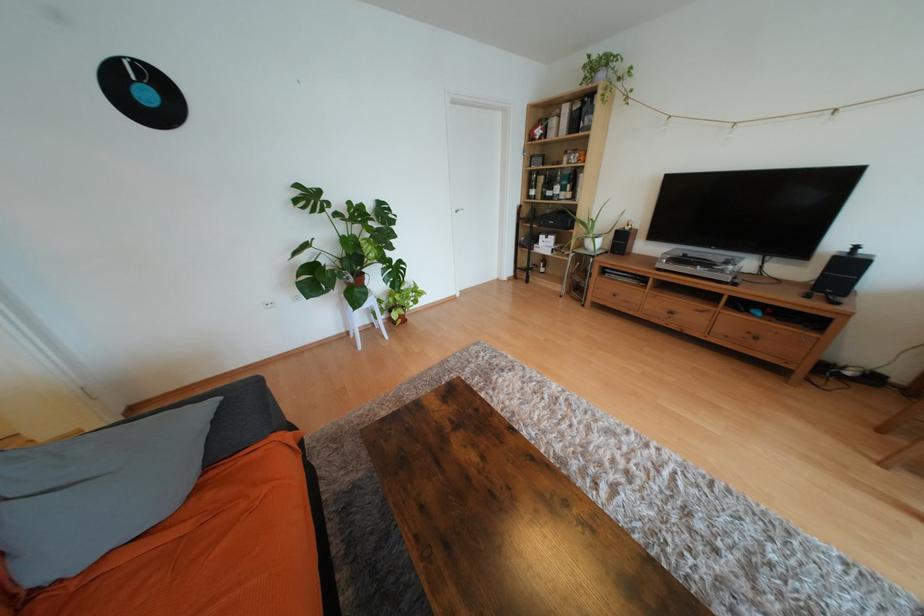
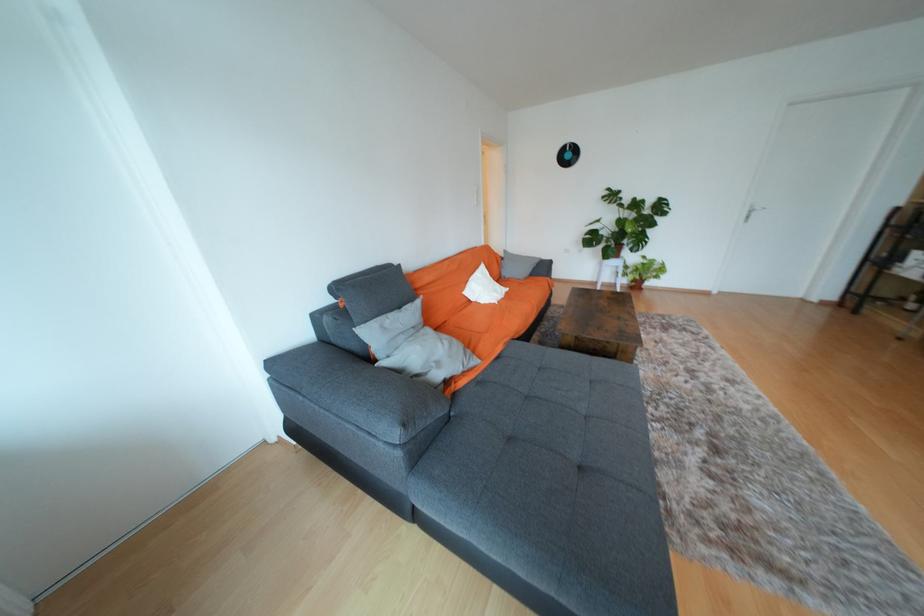
In the second image, find the point that corresponds to pixel 152 97 in the first image.

(574, 156)